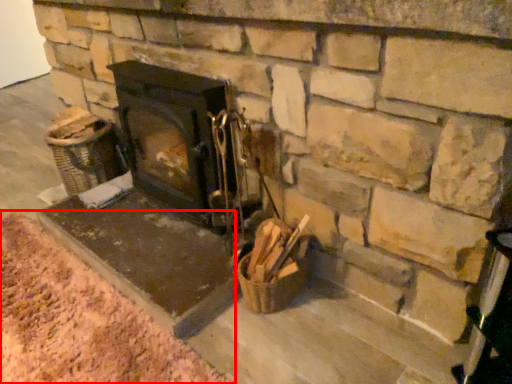
Question: From the image, what is the correct spatial relationship of debris (annotated by the red box) in relation to wood burning stove?

Choices:
 (A) right
 (B) left

Answer: (B)